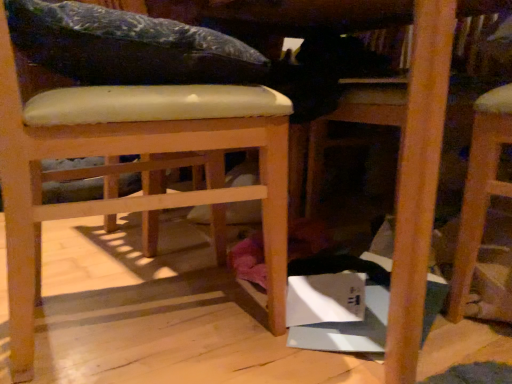
This screenshot has height=384, width=512. In order to click on vacant space underneath matte wood chair at center (from a real-world perspective) in this screenshot , I will do `click(134, 317)`.